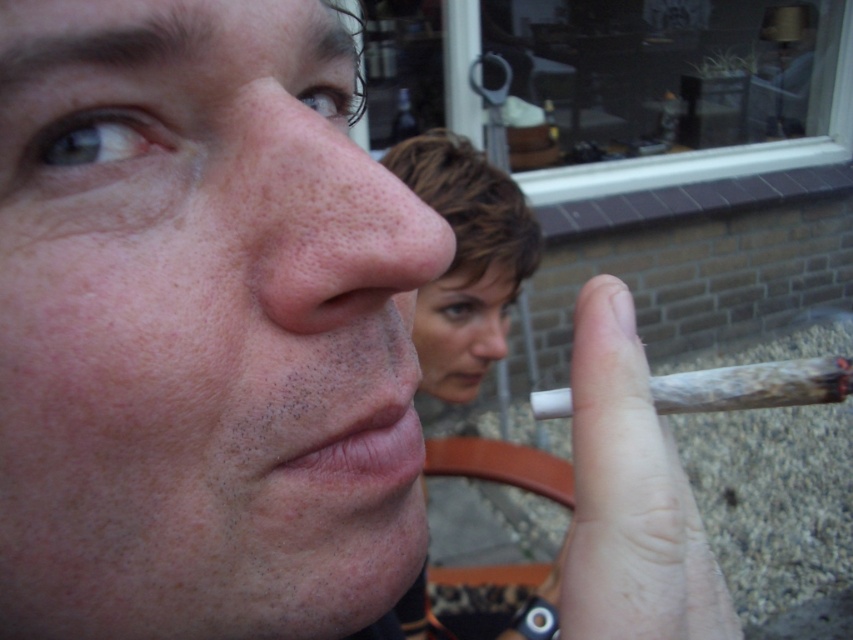
Question: From the image, what is the correct spatial relationship of pink flesh-colored nose at center in relation to smooth skin nose at center?

Choices:
 (A) left
 (B) right

Answer: (A)

Question: Does white matte cigarette at center appear on the right side of pink flesh-colored nose at center?

Choices:
 (A) no
 (B) yes

Answer: (B)

Question: Which of the following is the farthest from the observer?

Choices:
 (A) pink flesh-colored nose at center
 (B) dry matte lips at lower center

Answer: (B)

Question: Estimate the real-world distances between objects in this image. Which object is closer to the white matte cigarette at center?

Choices:
 (A) pink flesh-colored nose at center
 (B) dry matte lips at lower center
 (C) smooth skin nose at center

Answer: (B)

Question: Which of the following is the farthest from the observer?

Choices:
 (A) (601, 419)
 (B) (263, 115)
 (C) (407, 456)

Answer: (C)

Question: Is pink flesh-colored nose at center bigger than smooth skin nose at center?

Choices:
 (A) yes
 (B) no

Answer: (B)